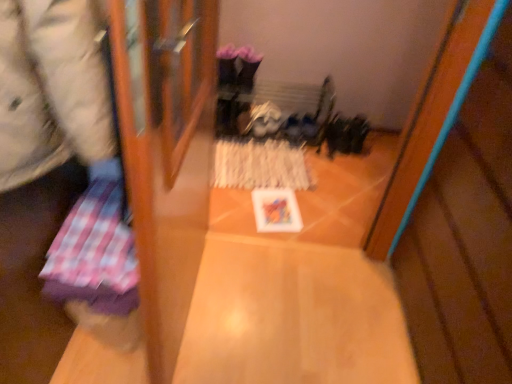
The width and height of the screenshot is (512, 384). Describe the element at coordinates (260, 165) in the screenshot. I see `white textured paper at center, which appears as the first wrapping paper when viewed from the top` at that location.

What is the approximate width of wooden table at center?

wooden table at center is 30.14 inches wide.

How much space does plaid fabric at left, acting as the first wrapping paper starting from the left, occupy horizontally?

plaid fabric at left, acting as the first wrapping paper starting from the left, is 14.03 inches in width.

You are a GUI agent. You are given a task and a screenshot of the screen. Output one action in this format:
    pyautogui.click(x=<x>, y=<y>)
    Task: Click on the white textured paper at center, positioned as the first wrapping paper in back-to-front order
    This screenshot has height=384, width=512.
    Given the screenshot: What is the action you would take?
    pyautogui.click(x=260, y=165)

Does point (254, 169) come behind point (477, 251)?

That is True.

Could you tell me if white textured paper at center, placed as the second wrapping paper when sorted from bottom to top, is turned towards wooden floor at lower right?

No, white textured paper at center, placed as the second wrapping paper when sorted from bottom to top, is not aimed at wooden floor at lower right.

From the image's perspective, relative to wooden floor at lower right, is white textured paper at center, the 1th wrapping paper viewed from the right, above or below?

Based on their image positions, white textured paper at center, the 1th wrapping paper viewed from the right, is located above wooden floor at lower right.

Considering the sizes of objects white textured paper at center, the 2th wrapping paper positioned from the left, and plaid fabric at left in the image provided, who is taller, white textured paper at center, the 2th wrapping paper positioned from the left, or plaid fabric at left?

plaid fabric at left.

From the picture: Is white textured paper at center, the 2th wrapping paper positioned from the left, oriented towards plaid fabric at left?

No, white textured paper at center, the 2th wrapping paper positioned from the left, is not aimed at plaid fabric at left.

Which of these two, white textured paper at center, the 1th wrapping paper viewed from the right, or plaid fabric at left, is smaller?

white textured paper at center, the 1th wrapping paper viewed from the right.

Which is more to the right, wooden table at center or plaid fabric at left?

From the viewer's perspective, wooden table at center appears more on the right side.

Does wooden table at center have a larger size compared to plaid fabric at left?

Actually, wooden table at center might be smaller than plaid fabric at left.

From the image's perspective, which one is positioned lower, wooden table at center or plaid fabric at left?

From the image's view, wooden table at center is below.

How many degrees apart are the facing directions of wooden table at center and plaid fabric at left?

The facing directions of wooden table at center and plaid fabric at left are 91.2 degrees apart.

Is plaid fabric at left facing towards white textured paper at center, the 1th wrapping paper viewed from the right?

No.

Considering the sizes of objects plaid fabric at left and white textured paper at center, the 2th wrapping paper positioned from the left, in the image provided, who is wider, plaid fabric at left or white textured paper at center, the 2th wrapping paper positioned from the left,?

white textured paper at center, the 2th wrapping paper positioned from the left, is wider.

How many degrees apart are the facing directions of plaid fabric at left and white textured paper at center, positioned as the first wrapping paper in back-to-front order?

plaid fabric at left and white textured paper at center, positioned as the first wrapping paper in back-to-front order, are facing 80.3 degrees away from each other.

Is plaid fabric at left taller or shorter than white textured paper at center, the 2th wrapping paper from the front?

plaid fabric at left is taller than white textured paper at center, the 2th wrapping paper from the front.

The image size is (512, 384). Identify the location of the 1st wrapping paper located above the wooden table at center (from a real-world perspective). (260, 165).

Is wooden table at center positioned before white textured paper at center, the 1th wrapping paper viewed from the right?

Yes.

From a real-world perspective, is wooden table at center under white textured paper at center, the 2th wrapping paper from the front?

Yes.

Does wooden table at center have a lesser height compared to white textured paper at center, which appears as the first wrapping paper when viewed from the top?

In fact, wooden table at center may be taller than white textured paper at center, which appears as the first wrapping paper when viewed from the top.

From the image's perspective, which one is positioned higher, plaid fabric at left or wooden table at center?

From the image's view, plaid fabric at left is above.

Considering the sizes of plaid fabric at left and wooden table at center in the image, is plaid fabric at left wider or thinner than wooden table at center?

plaid fabric at left is thinner than wooden table at center.

Is plaid fabric at left not near wooden table at center?

Yes.

From the picture: Considering the sizes of plaid fabric at left and wooden table at center in the image, is plaid fabric at left bigger or smaller than wooden table at center?

Considering their sizes, plaid fabric at left takes up more space than wooden table at center.

Is wooden floor at lower right at the back of plaid fabric at left?

plaid fabric at left is not turned away from wooden floor at lower right.

In the scene shown: From the image's perspective, which is below, plaid fabric at left or wooden floor at lower right?

wooden floor at lower right.

Can you confirm if plaid fabric at left is taller than wooden floor at lower right?

No.

What's the angular difference between plaid fabric at left and wooden floor at lower right's facing directions?

178 degrees.

Locate an element on the screen. The width and height of the screenshot is (512, 384). wood to the right of white textured paper at center, the 2th wrapping paper positioned from the left is located at coordinates (465, 238).

Locate an element on the screen. clothing that appears in front of the white textured paper at center, positioned as the first wrapping paper in back-to-front order is located at coordinates (51, 89).

Based on their spatial positions, is wooden floor at lower right or wooden table at center closer to white textured paper at center, which appears as the first wrapping paper when viewed from the top?

Based on the image, wooden table at center appears to be nearer to white textured paper at center, which appears as the first wrapping paper when viewed from the top.

From the image, which object appears to be farther from wooden floor at lower right, white textured paper at center, placed as the second wrapping paper when sorted from bottom to top, or plaid fabric at left?

Based on the image, white textured paper at center, placed as the second wrapping paper when sorted from bottom to top, appears to be further to wooden floor at lower right.

Looking at the image, which one is located further to wooden floor at lower right, white textured paper at center, positioned as the first wrapping paper in back-to-front order, or plaid fabric at left, placed as the 2th wrapping paper when sorted from right to left?

white textured paper at center, positioned as the first wrapping paper in back-to-front order.

Considering their positions, is wooden floor at lower right positioned further to white textured paper at center, the 2th wrapping paper positioned from the left, than plaid fabric at left?

The object further to white textured paper at center, the 2th wrapping paper positioned from the left, is plaid fabric at left.

Considering their positions, is wooden table at center positioned further to white textured paper at center, placed as the second wrapping paper when sorted from bottom to top, than wooden floor at lower right?

Among the two, wooden floor at lower right is located further to white textured paper at center, placed as the second wrapping paper when sorted from bottom to top.

Looking at the image, which one is located closer to plaid fabric at left, wooden table at center or plaid fabric at left, placed as the second wrapping paper when sorted from top to bottom?

Based on the image, plaid fabric at left, placed as the second wrapping paper when sorted from top to bottom, appears to be nearer to plaid fabric at left.

Which object lies further to the anchor point plaid fabric at left, plaid fabric at left, the first wrapping paper ordered from the bottom, or wooden table at center?

wooden table at center lies further to plaid fabric at left than the other object.

Based on the photo, which object lies further to the anchor point plaid fabric at left, plaid fabric at left, placed as the second wrapping paper when sorted from top to bottom, or white textured paper at center, the 1th wrapping paper viewed from the right?

white textured paper at center, the 1th wrapping paper viewed from the right.

Find the location of a particular element. This screenshot has height=384, width=512. wrapping paper located between plaid fabric at left and white textured paper at center, which appears as the first wrapping paper when viewed from the top, in the depth direction is located at coordinates (94, 253).

Where is `wide between plaid fabric at left, the first wrapping paper ordered from the bottom, and wooden floor at lower right, in the horizontal direction`? wide between plaid fabric at left, the first wrapping paper ordered from the bottom, and wooden floor at lower right, in the horizontal direction is located at coordinates pyautogui.click(x=293, y=317).

Locate an element on the screen. wood between plaid fabric at left and white textured paper at center, placed as the second wrapping paper when sorted from bottom to top, along the z-axis is located at coordinates click(465, 238).

Locate an element on the screen. wrapping paper located between wooden floor at lower right and white textured paper at center, which appears as the first wrapping paper when viewed from the top, in the depth direction is located at coordinates point(94,253).